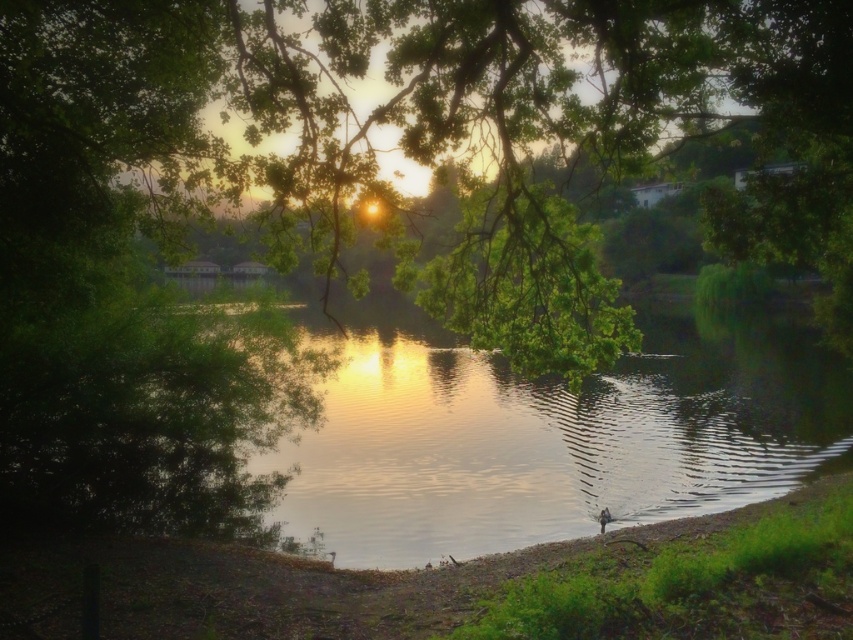
You are planning to place a small wooden boat in the scene. The boat requires a surface wider than the dull brown dirt at lower center to float. Based on the scene, can the green reflective water at center accommodate the boat?

The green reflective water at center has a larger width than the dull brown dirt at lower center, so yes, the boat can float on the green reflective water at center as it meets the required width.

From the picture: You are a photographer wanting to capture the reflection of the sunset on the water. You are standing on the dull brown dirt at lower center. To get the best shot, you need to move towards the green reflective water at center. Which direction should you move relative to your current position?

Since the dull brown dirt at lower center is behind green reflective water at center, you should move forward towards the green reflective water at center to capture the reflection.

You are standing at the edge of the lake and want to place a small statue on the ground so that it is partially submerged in the water. Given the height difference between the green reflective water at center and the dull brown dirt at lower center, will the statue be mostly visible above water or mostly submerged?

The green reflective water at center is taller than the dull brown dirt at lower center, meaning the water level is higher than the dirt area. If you place the statue on the dull brown dirt at lower center, it will be mostly submerged in the water since the water is higher than the dirt area.